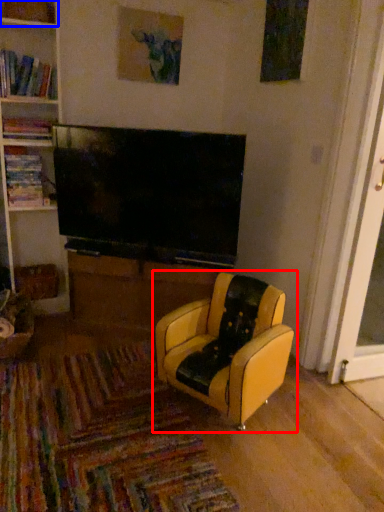
Question: Among these objects, which one is farthest to the camera, chair (highlighted by a red box) or shelf (highlighted by a blue box)?

Choices:
 (A) chair
 (B) shelf

Answer: (B)